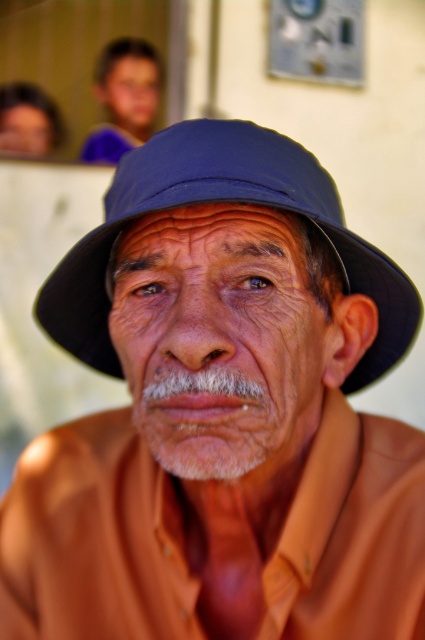
You are a photographer who wants to adjust the lighting setup for the shoot. You have a spotlight that can only illuminate objects within a 2 meter radius. Are both the blue fabric fedora at center and the blue fabric hat at upper center within the spotlight range?

The distance between the blue fabric fedora at center and blue fabric hat at upper center is 2.76 meters, which exceeds the 2 meter radius of the spotlight. Therefore, the spotlight cannot illuminate both objects simultaneously.

From the picture: You are a photographer trying to capture a close portrait of the man. You notice two blue fabric hats in the image. Which one is narrower in width between the blue fabric fedora at center and the blue fabric hat at upper center?

The blue fabric fedora at center is narrower in width compared to the blue fabric hat at upper center.

You are a photographer adjusting the focus of your camera to capture the man in the scene. You notice a point at coordinates (218, 200). What object is located at this point?

The blue fabric fedora at center is located at point (218, 200).